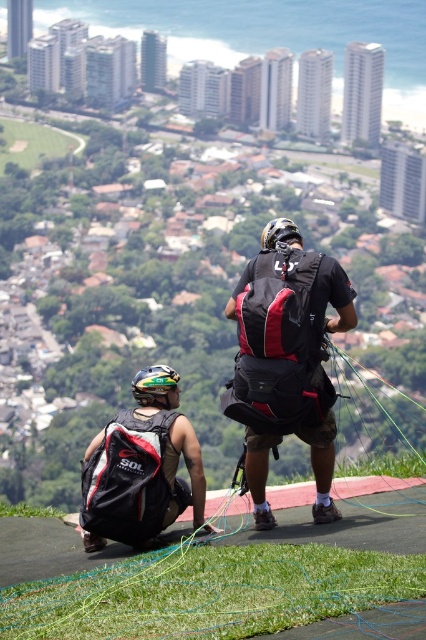
Question: Is matte black backpack at center above matte black backpack at lower left?

Choices:
 (A) yes
 (B) no

Answer: (A)

Question: Is matte black backpack at center to the left of matte black backpack at lower left from the viewer's perspective?

Choices:
 (A) yes
 (B) no

Answer: (B)

Question: In this image, where is matte black backpack at center located relative to matte black backpack at lower left?

Choices:
 (A) below
 (B) above

Answer: (B)

Question: Among these points, which one is nearest to the camera?

Choices:
 (A) (255, 400)
 (B) (158, 404)

Answer: (A)